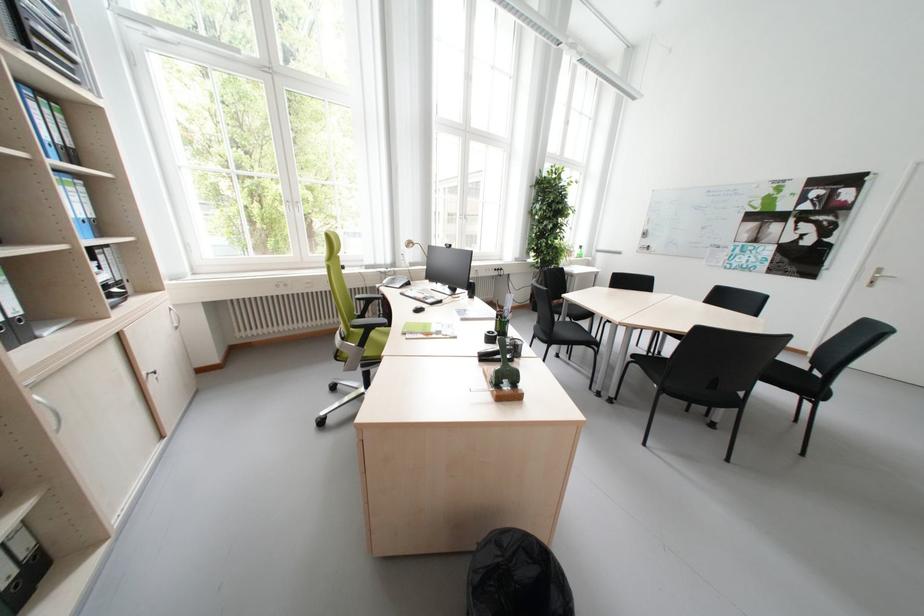
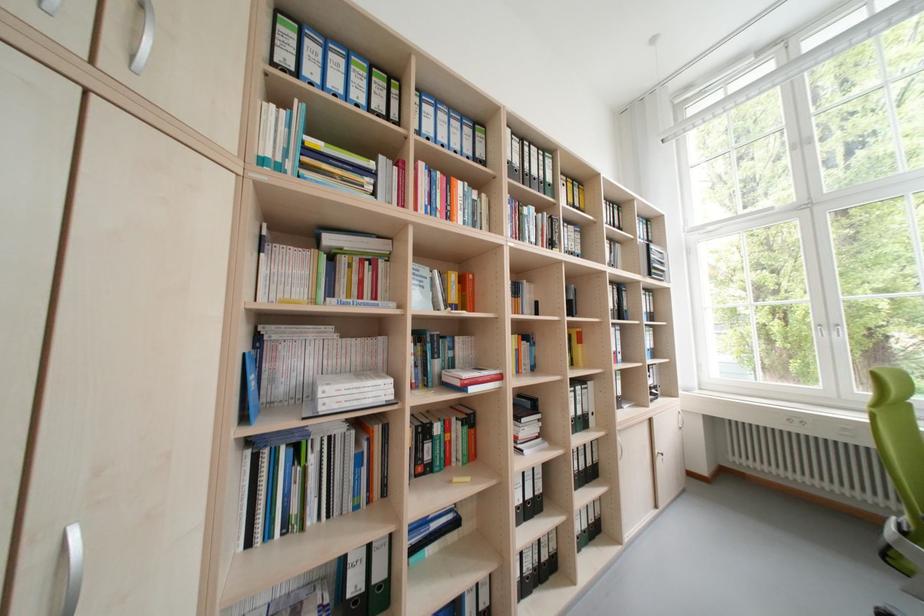
Question: The images are taken continuously from a first-person perspective. In which direction is your viewpoint rotating?

Choices:
 (A) Left
 (B) Right
 (C) Up
 (D) Down

Answer: (A)